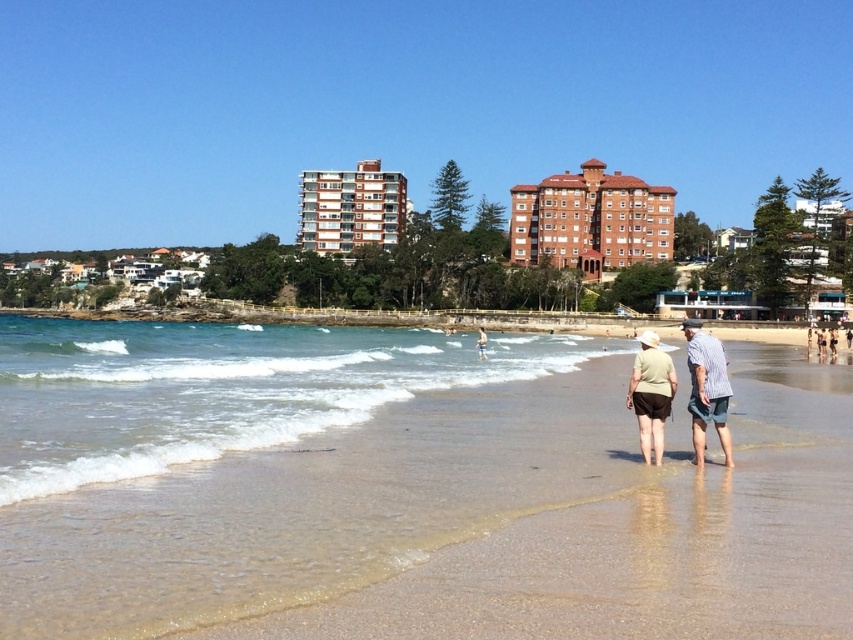
Who is taller, clear water at lower center or light brown wooden surfboard at center?

clear water at lower center

Does clear water at lower center have a greater width compared to light brown wooden surfboard at center?

Correct, the width of clear water at lower center exceeds that of light brown wooden surfboard at center.

Is point (285, 332) behind point (834, 355)?

Yes.

This screenshot has height=640, width=853. Identify the location of clear water at lower center. 219,388.

Between point (721, 428) and point (656, 458), which one is positioned in front?

Point (656, 458)

Which is below, striped cotton shirt at lower right or khaki cotton shirt at center?

Positioned lower is khaki cotton shirt at center.

Which is in front, point (717, 424) or point (660, 422)?

Point (717, 424) is in front.

This screenshot has height=640, width=853. I want to click on striped cotton shirt at lower right, so click(x=706, y=388).

Who is positioned more to the left, light brown wooden surfboard at center or light brown shorts at lower center?

From the viewer's perspective, light brown shorts at lower center appears more on the left side.

Can you confirm if light brown wooden surfboard at center is positioned below light brown shorts at lower center?

Yes.

Does point (807, 336) lie in front of point (480, 326)?

Yes.

Find the location of `light brown wooden surfboard at center`. light brown wooden surfboard at center is located at coordinates (822, 340).